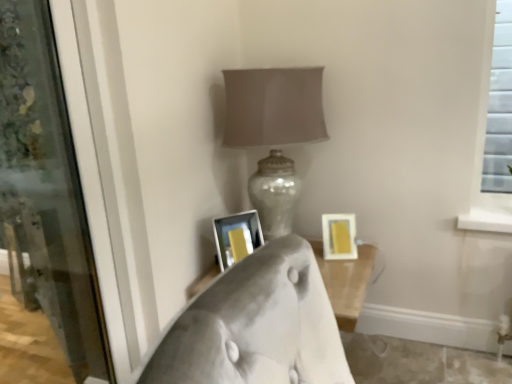
Question: From the image's perspective, is white glossy picture frame at center, the first picture frame from the left, beneath transparent glass screen door at left?

Choices:
 (A) no
 (B) yes

Answer: (B)

Question: From a real-world perspective, is white glossy picture frame at center, which is the 2th picture frame in right-to-left order, located beneath transparent glass screen door at left?

Choices:
 (A) yes
 (B) no

Answer: (A)

Question: Is white glossy picture frame at center, the first picture frame from the left, taller than transparent glass screen door at left?

Choices:
 (A) no
 (B) yes

Answer: (A)

Question: Is white glossy picture frame at center, the first picture frame from the left, not close to transparent glass screen door at left?

Choices:
 (A) no
 (B) yes

Answer: (A)

Question: Can you confirm if white glossy picture frame at center, the first picture frame from the left, is positioned to the left of transparent glass screen door at left?

Choices:
 (A) yes
 (B) no

Answer: (B)

Question: Does white glossy picture frame at center, which is the 2th picture frame in right-to-left order, have a larger size compared to transparent glass screen door at left?

Choices:
 (A) yes
 (B) no

Answer: (B)

Question: Is white glossy picture frame at center, the first picture frame from the left, shorter than matte silver lamp at center?

Choices:
 (A) yes
 (B) no

Answer: (A)

Question: Is white glossy picture frame at center, which is the 2th picture frame in right-to-left order, aimed at matte silver lamp at center?

Choices:
 (A) no
 (B) yes

Answer: (A)

Question: Is white glossy picture frame at center, which is the 2th picture frame in right-to-left order, outside of matte silver lamp at center?

Choices:
 (A) no
 (B) yes

Answer: (B)

Question: Would you say white glossy picture frame at center, which is the 2th picture frame in right-to-left order, contains matte silver lamp at center?

Choices:
 (A) no
 (B) yes

Answer: (A)

Question: From a real-world perspective, is white glossy picture frame at center, which is the 2th picture frame in right-to-left order, located beneath matte silver lamp at center?

Choices:
 (A) yes
 (B) no

Answer: (A)

Question: From the image's perspective, would you say white glossy picture frame at center, which is the 2th picture frame in right-to-left order, is shown under matte silver lamp at center?

Choices:
 (A) yes
 (B) no

Answer: (A)

Question: Does matte silver lamp at center have a smaller size compared to white glossy picture frame at center, the first picture frame from the left?

Choices:
 (A) yes
 (B) no

Answer: (B)